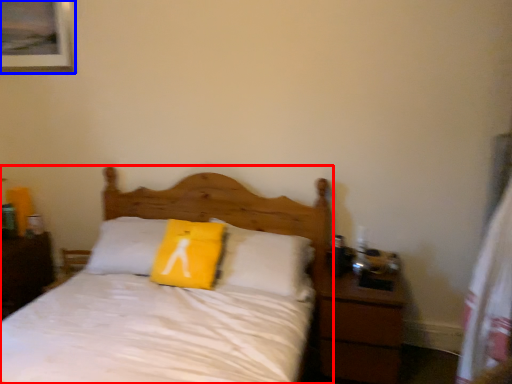
Question: Among these objects, which one is farthest to the camera, bed (highlighted by a red box) or picture frame (highlighted by a blue box)?

Choices:
 (A) bed
 (B) picture frame

Answer: (B)